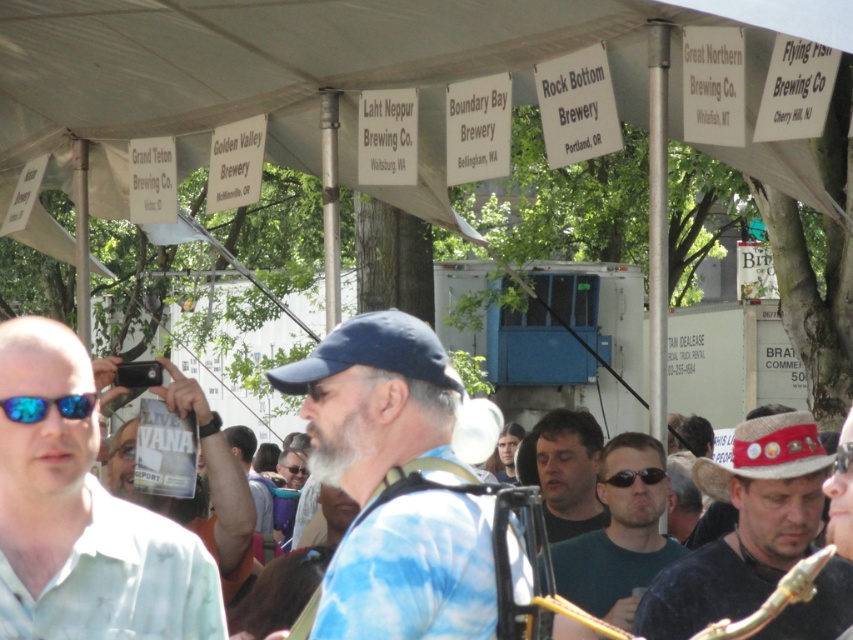
From the picture: Does white matte shirt at left lie in front of blue reflective lens sunglasses at lower left?

Yes, white matte shirt at left is in front of blue reflective lens sunglasses at lower left.

Is white matte shirt at left positioned behind blue reflective lens sunglasses at lower left?

No, white matte shirt at left is closer to the viewer.

Where is `white matte shirt at left`? The width and height of the screenshot is (853, 640). white matte shirt at left is located at coordinates (90, 547).

Between dark green t-shirt at center and dark green shirt at center, which one is positioned lower?

dark green t-shirt at center

Is point (587, 548) positioned after point (585, 492)?

No, (587, 548) is in front of (585, 492).

Between point (664, 502) and point (585, 429), which one is positioned behind?

The point (585, 429) is more distant.

Identify the location of dark green t-shirt at center. (619, 532).

Image resolution: width=853 pixels, height=640 pixels. I want to click on blue fabric baseball cap at center, so click(x=370, y=352).

Between blue fabric baseball cap at center and blue reflective lens sunglasses at lower left, which one is positioned higher?

blue fabric baseball cap at center

Does point (422, 346) lie behind point (90, 394)?

No, it is in front of (90, 394).

What are the coordinates of `blue fabric baseball cap at center` in the screenshot? It's located at (370, 352).